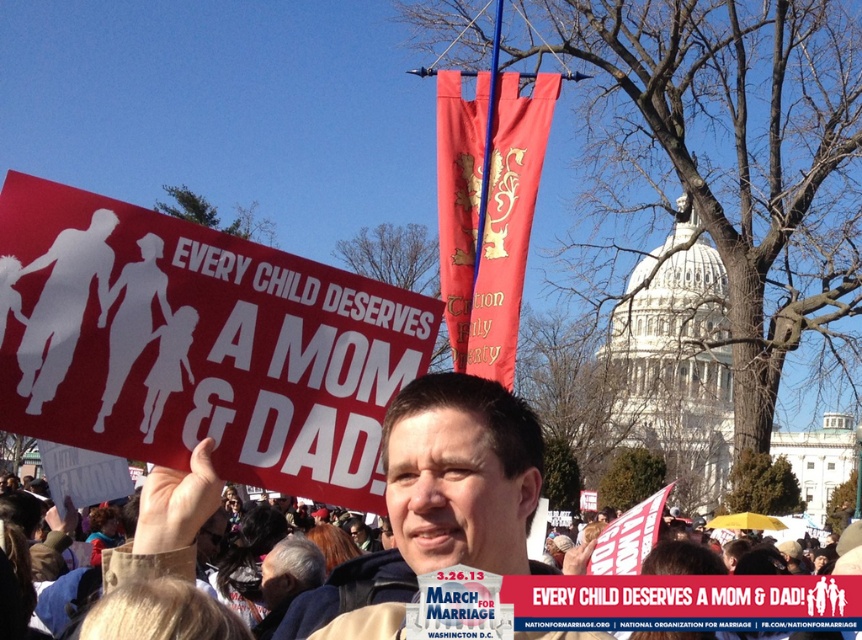
You are a photographer standing at a certain point. You want to take a photo of the matte red sign at left while ensuring that the camera remains exactly 223.31 feet away from it. Given the scene described, is this feasible?

Yes, because the matte red sign at left and camera are already 223.31 feet apart from each other according to the description.

You are a photographer trying to capture both the matte red sign at left and the matte black sign at center in a single frame. Given that your camera can only accommodate objects up to the size of the larger sign, will you be able to fit both signs in the frame?

The matte red sign at left is larger than the matte black sign at center. Since the camera can accommodate up to the size of the larger sign, both signs can fit in the frame as the smaller one is within the size limit.